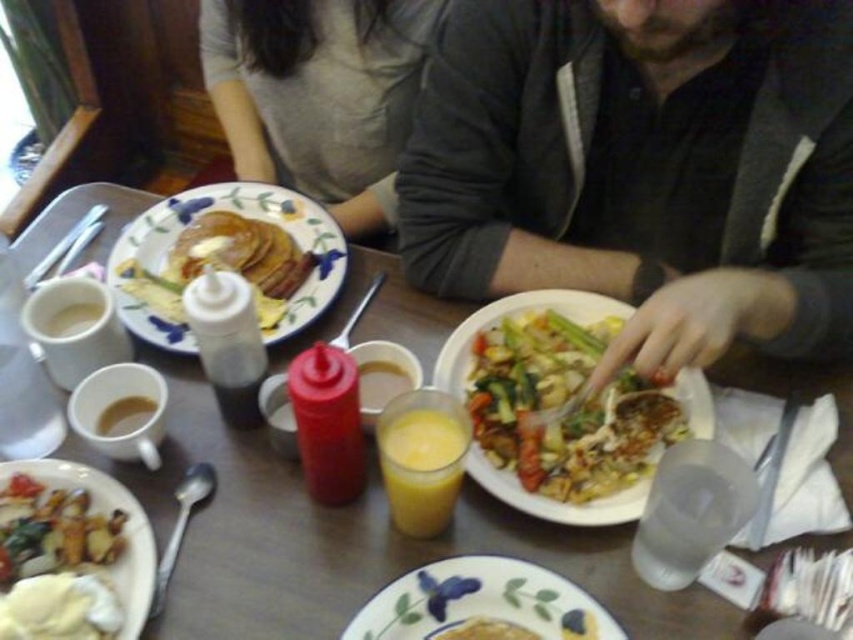
Question: Is dark gray jacket at center wider than porcelain plate with floral design at upper left?

Choices:
 (A) yes
 (B) no

Answer: (A)

Question: Which object is closer to the camera taking this photo?

Choices:
 (A) translucent glass juice at center
 (B) matte gray sweater at upper center

Answer: (A)

Question: Is dark gray jacket at center to the left of porcelain plate with floral design at upper left from the viewer's perspective?

Choices:
 (A) yes
 (B) no

Answer: (B)

Question: Among these objects, which one is nearest to the camera?

Choices:
 (A) dark gray jacket at center
 (B) translucent glass juice at center
 (C) matte white plate with floral design at lower left
 (D) white ceramic plate at center

Answer: (B)

Question: Which point is closer to the camera?

Choices:
 (A) dark gray jacket at center
 (B) matte gray sweater at upper center

Answer: (A)

Question: Can you confirm if matte gray sweater at upper center is smaller than translucent glass juice at center?

Choices:
 (A) yes
 (B) no

Answer: (B)